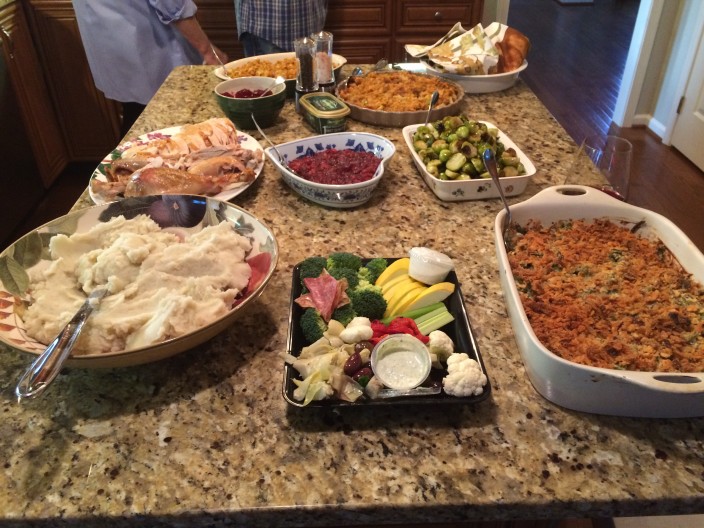
Find the location of a particular element. The width and height of the screenshot is (704, 528). kitchen island is located at coordinates [x=396, y=213].